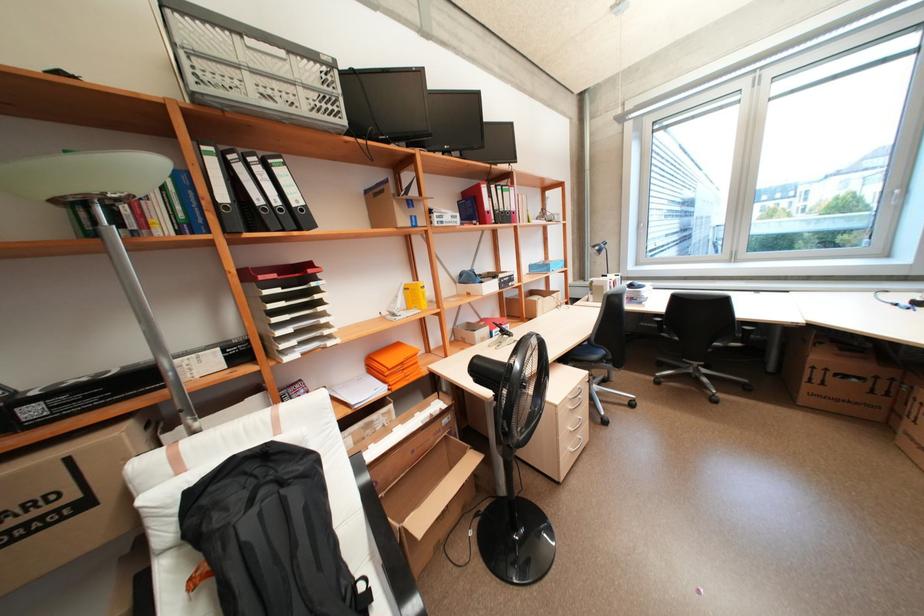
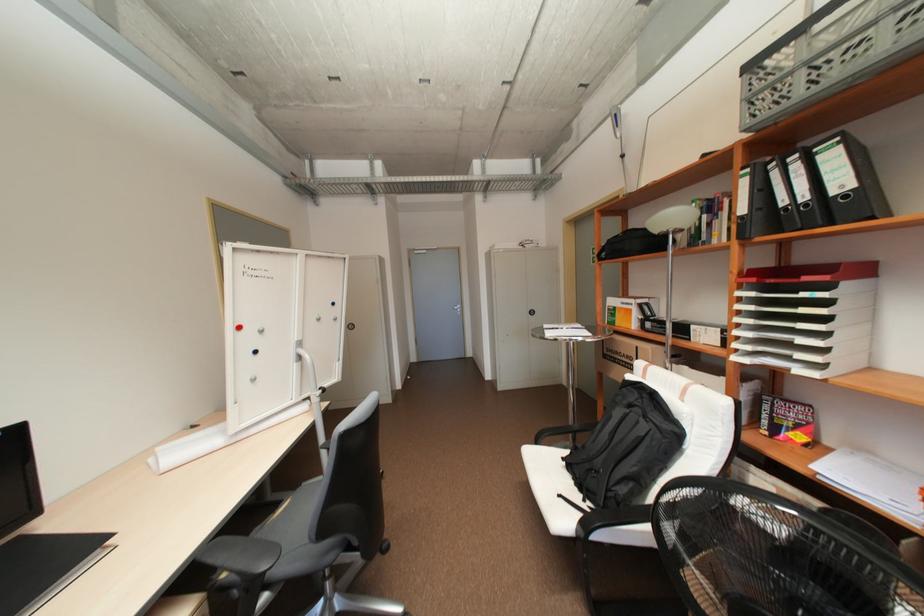
Find the pixel in the second image that matches (x=307, y=209) in the first image.

(852, 197)